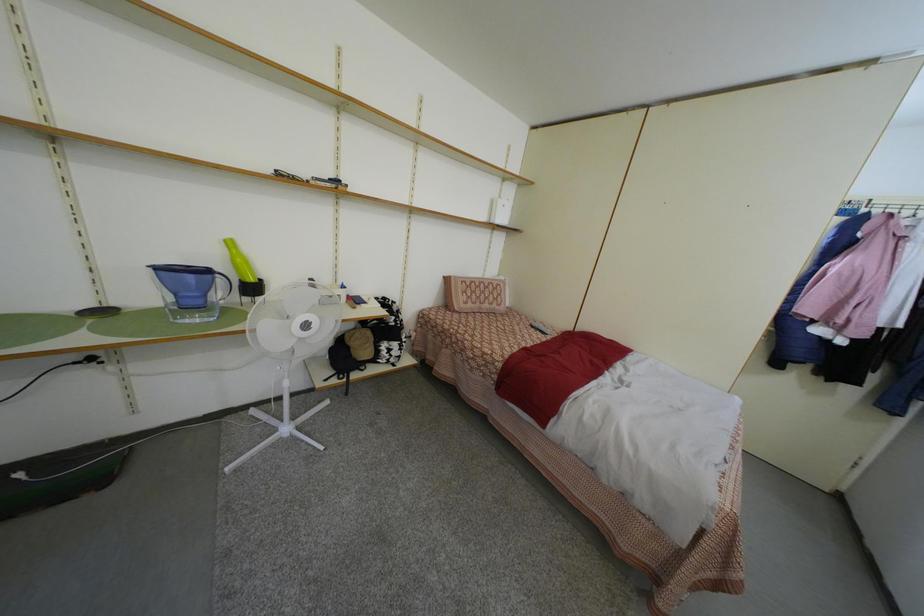
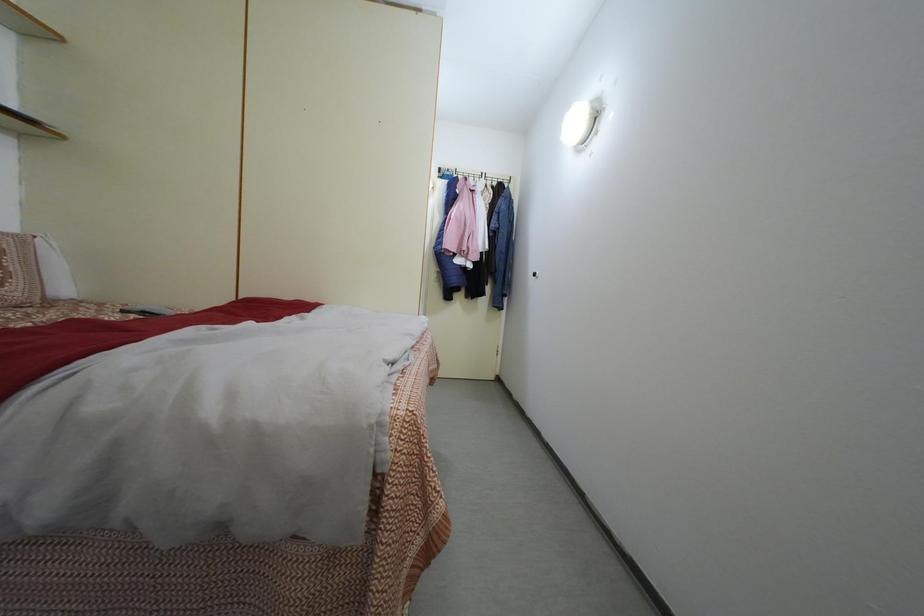
Question: The camera is either moving clockwise (left) or counter-clockwise (right) around the object. The first image is from the beginning of the video and the second image is from the end. Is the camera moving left or right when shooting the video?

Choices:
 (A) Left
 (B) Right

Answer: (A)